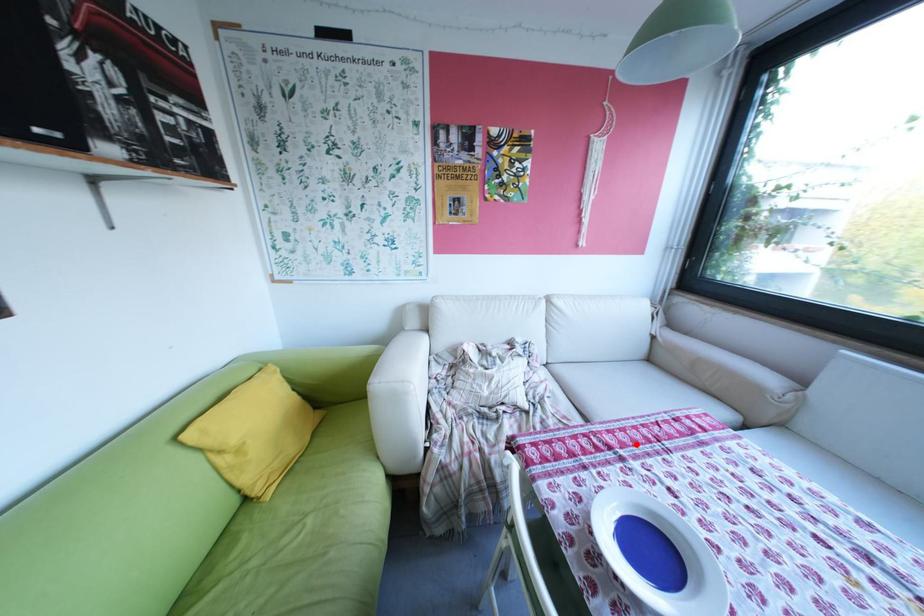
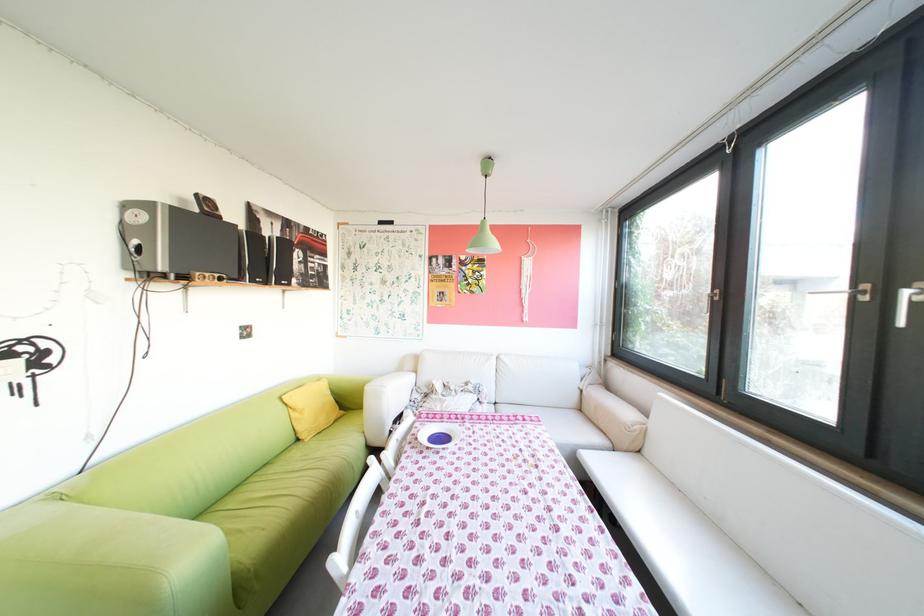
Question: I am providing you with two images of the same scene from different viewpoints. In image1, a red point is highlighted. Considering the same 3D point in image2, which of the following is correct?

Choices:
 (A) It is closer
 (B) It is farther

Answer: (A)